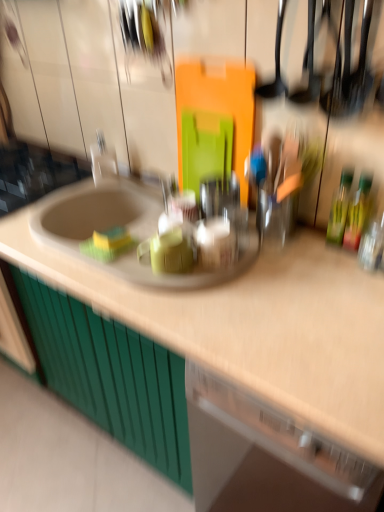
Question: In terms of size, does beige laminate countertop at center appear bigger or smaller than green matte cabinet at lower left?

Choices:
 (A) small
 (B) big

Answer: (B)

Question: From their relative heights in the image, would you say beige laminate countertop at center is taller or shorter than green matte cabinet at lower left?

Choices:
 (A) tall
 (B) short

Answer: (A)

Question: Estimate the real-world distances between objects in this image. Which object is closer to the green matte cabinet at lower left?

Choices:
 (A) green glass bottle at right, marked as the second bottle in a left-to-right arrangement
 (B) white glossy faucet at upper left
 (C) green glass bottle at right, the 1th bottle when ordered from left to right
 (D) beige laminate countertop at center

Answer: (D)

Question: Considering the real-world distances, which object is closest to the white glossy faucet at upper left?

Choices:
 (A) beige laminate countertop at center
 (B) green matte cabinet at lower left
 (C) green glass bottle at right, arranged as the first bottle when viewed from the right
 (D) green glass bottle at right, which ranks as the 2th bottle in right-to-left order

Answer: (B)